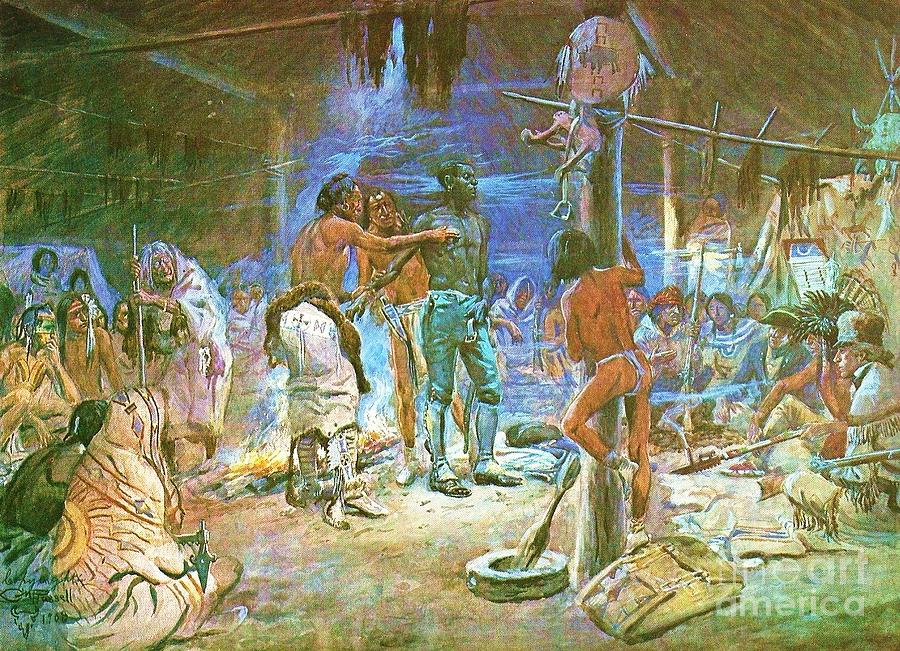
Where is `the chest`? The height and width of the screenshot is (651, 900). the chest is located at coordinates (410, 278), (466, 260).